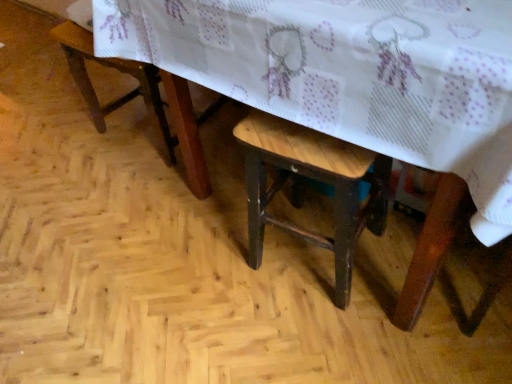
Locate an element on the screen. vacant space positioned to the left of wooden stool at center is located at coordinates (212, 266).